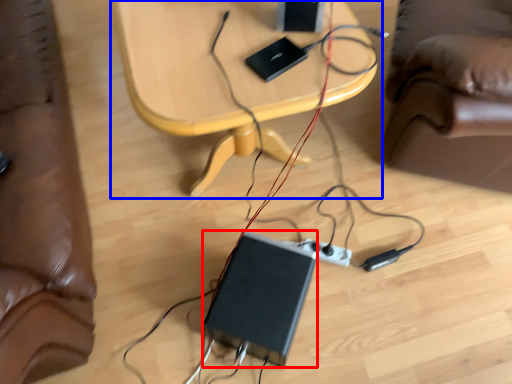
Question: Which object appears farthest to the camera in this image, computer (highlighted by a red box) or table (highlighted by a blue box)?

Choices:
 (A) computer
 (B) table

Answer: (A)